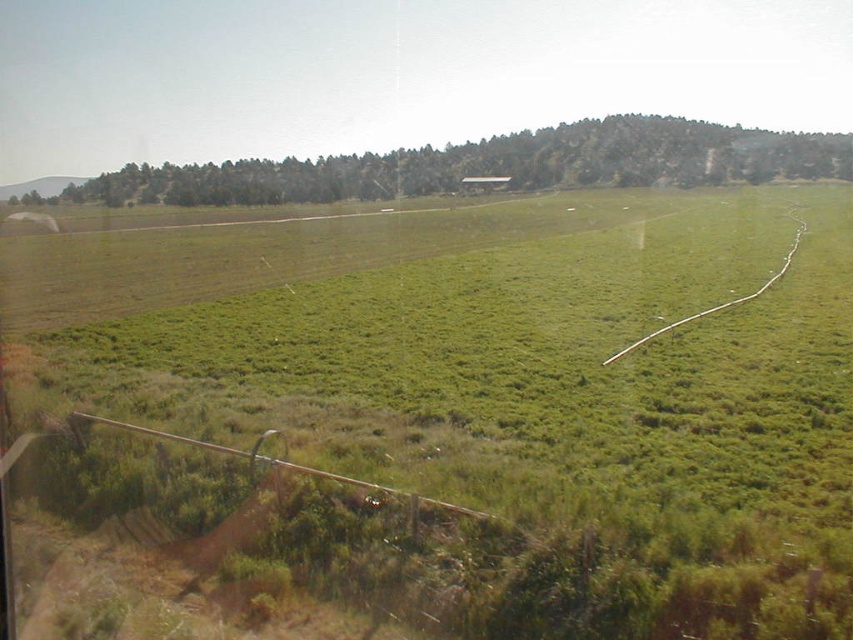
Question: Can you confirm if green grassy field at center is positioned below green grassy hillside at upper center?

Choices:
 (A) yes
 (B) no

Answer: (A)

Question: From the image, what is the correct spatial relationship of green grassy field at center in relation to green grassy hillside at upper center?

Choices:
 (A) right
 (B) left

Answer: (A)

Question: Which of the following is the farthest from the observer?

Choices:
 (A) green grassy hillside at upper center
 (B) green grassy field at center

Answer: (A)

Question: Can you confirm if green grassy field at center is thinner than green grassy hillside at upper center?

Choices:
 (A) yes
 (B) no

Answer: (A)

Question: Which object appears farthest from the camera in this image?

Choices:
 (A) green grassy field at center
 (B) green grassy hillside at upper center

Answer: (B)